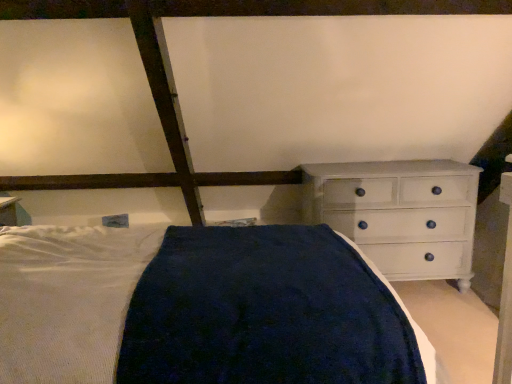
This screenshot has height=384, width=512. I want to click on vacant space situated above white painted wood chest of drawers at right (from a real-world perspective), so click(393, 165).